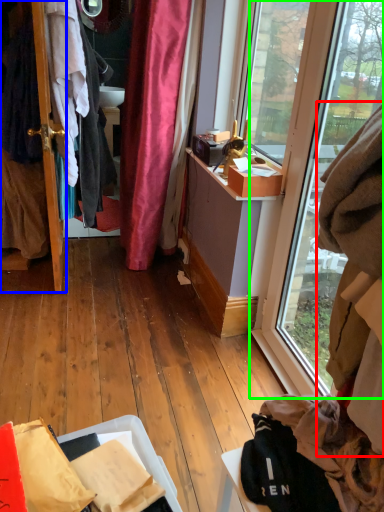
Question: Which object is positioned closest to clothing (highlighted by a red box)? Select from door (highlighted by a blue box) and window (highlighted by a green box).

Choices:
 (A) door
 (B) window

Answer: (B)